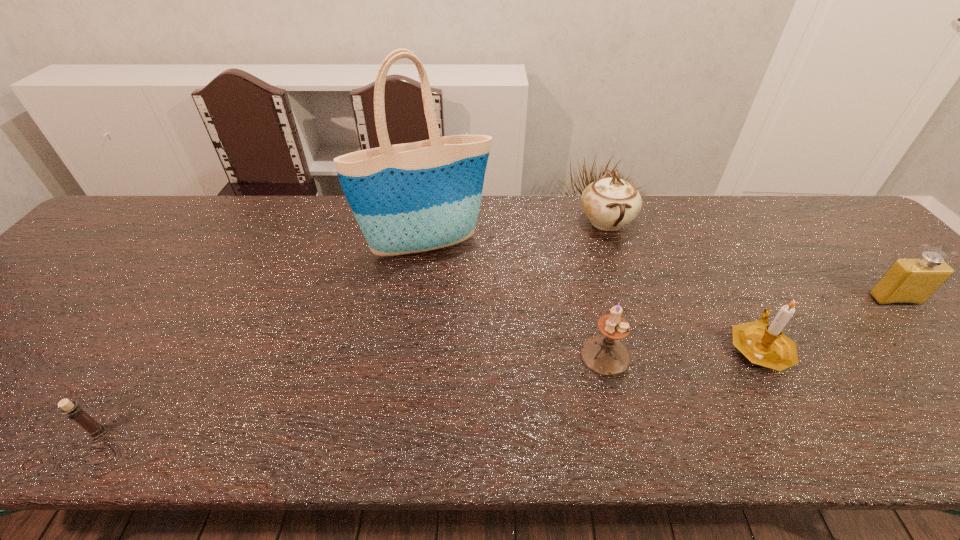
Image resolution: width=960 pixels, height=540 pixels. I want to click on free spot between the perfume and the chinaware, so click(751, 260).

Find the location of a particular element. The image size is (960, 540). empty space between the chinaware and the leftmost candle holder is located at coordinates (352, 327).

Where is `vacant area that lies between the second candle holder from right to left and the chinaware`? The height and width of the screenshot is (540, 960). vacant area that lies between the second candle holder from right to left and the chinaware is located at coordinates (606, 288).

Where is `free spot between the tote bag and the chinaware`? Image resolution: width=960 pixels, height=540 pixels. free spot between the tote bag and the chinaware is located at coordinates (516, 234).

In order to click on object that is the second closest to the perfume in this screenshot , I will do `click(610, 203)`.

Choose which object is the nearest neighbor to the tote bag. Please provide its 2D coordinates. Your answer should be formatted as a tuple, i.e. [(x, y)], where the tuple contains the x and y coordinates of a point satisfying the conditions above.

[(610, 203)]

Identify the location of candle holder identified as the third closest to the perfume. (73, 411).

Point out which candle holder is positioned as the second nearest to the tallest object. Please provide its 2D coordinates. Your answer should be formatted as a tuple, i.e. [(x, y)], where the tuple contains the x and y coordinates of a point satisfying the conditions above.

[(764, 344)]